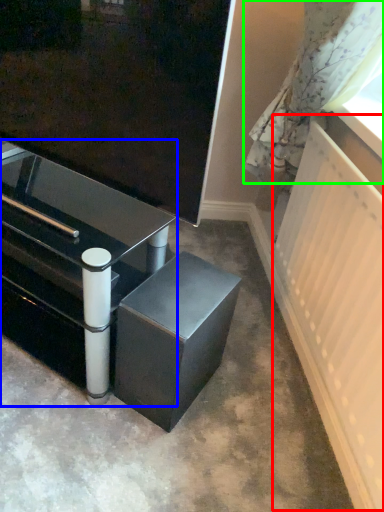
Question: Considering the real-world distances, which object is closest to radiator (highlighted by a red box)? table (highlighted by a blue box) or curtain (highlighted by a green box).

Choices:
 (A) table
 (B) curtain

Answer: (B)